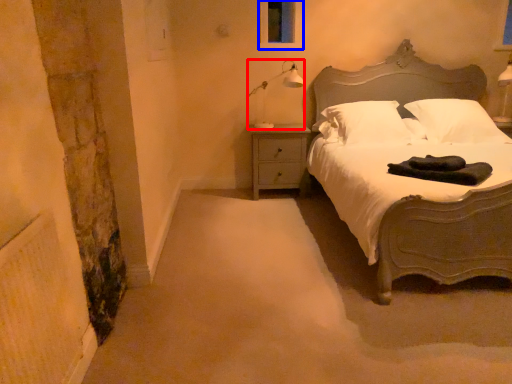
Question: Which of the following is the closest to the observer, lamp (highlighted by a red box) or window screen (highlighted by a blue box)?

Choices:
 (A) lamp
 (B) window screen

Answer: (A)